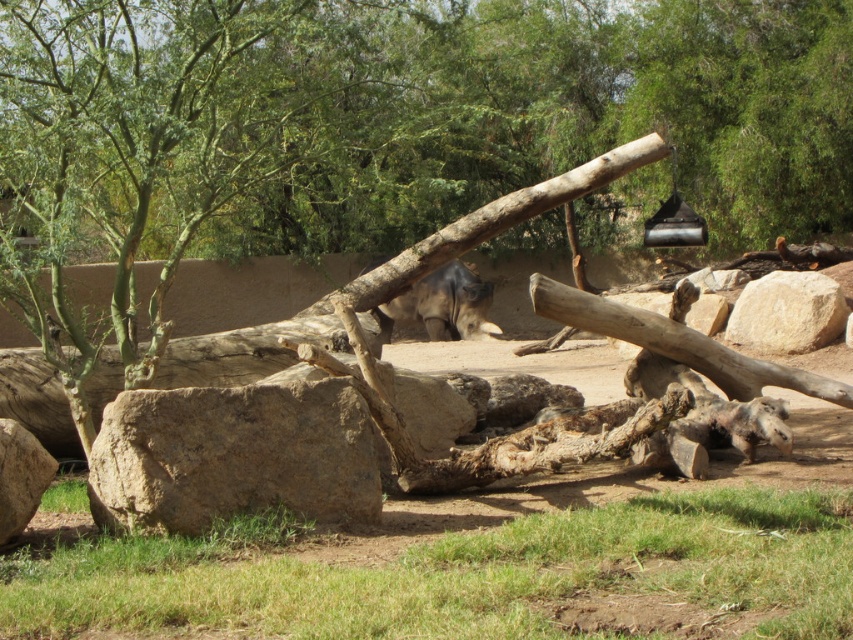
Question: Which object is the closest to the gray matte rhino at center?

Choices:
 (A) beige rough rock at right
 (B) brown rough tree trunk at center
 (C) brown rough rock at lower left
 (D) smooth gray rock at lower left

Answer: (B)

Question: Does beige rough rock at right come in front of smooth gray rock at lower left?

Choices:
 (A) no
 (B) yes

Answer: (A)

Question: Which object is farther from the camera taking this photo?

Choices:
 (A) beige rough rock at right
 (B) gray matte rhino at center
 (C) brown rough tree trunk at center
 (D) brown rough rock at lower left

Answer: (B)

Question: Is the position of brown rough tree trunk at center more distant than that of brown rough rock at lower left?

Choices:
 (A) yes
 (B) no

Answer: (A)

Question: Is brown rough rock at lower left thinner than gray matte rhino at center?

Choices:
 (A) yes
 (B) no

Answer: (B)

Question: Which point appears closest to the camera in this image?

Choices:
 (A) (753, 104)
 (B) (331, 513)

Answer: (B)